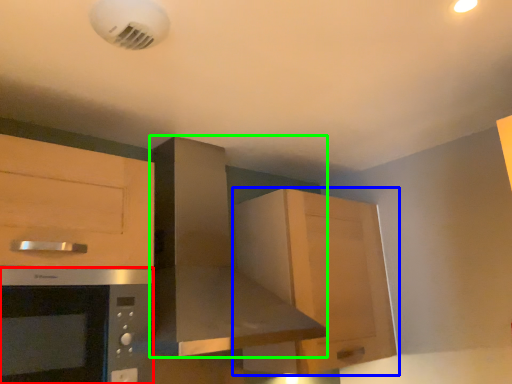
Question: Which is farther away from microwave oven (highlighted by a red box)? cabinetry (highlighted by a blue box) or home appliance (highlighted by a green box)?

Choices:
 (A) cabinetry
 (B) home appliance

Answer: (A)